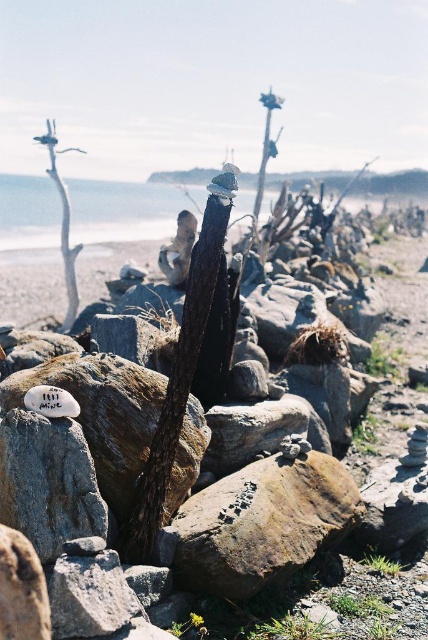
Does smooth gray tree trunk at left have a lesser height compared to smooth bark tree trunk at center?

Incorrect, smooth gray tree trunk at left's height does not fall short of smooth bark tree trunk at center's.

Does smooth gray tree trunk at left have a greater width compared to smooth bark tree trunk at center?

Yes, smooth gray tree trunk at left is wider than smooth bark tree trunk at center.

Where is `smooth gray tree trunk at left`? smooth gray tree trunk at left is located at coordinates (62, 224).

Does rough textured rock at center come behind smooth gray tree trunk at left?

No, rough textured rock at center is in front of smooth gray tree trunk at left.

Can you confirm if rough textured rock at center is positioned above smooth gray tree trunk at left?

No.

Locate an element on the screen. rough textured rock at center is located at coordinates (262, 524).

Which is behind, point (225, 573) or point (275, 148)?

The point (275, 148) is more distant.

Does rough textured rock at center lie in front of smooth bark tree trunk at center?

That is True.

Find the location of a particular element. The image size is (428, 640). rough textured rock at center is located at coordinates [x=262, y=524].